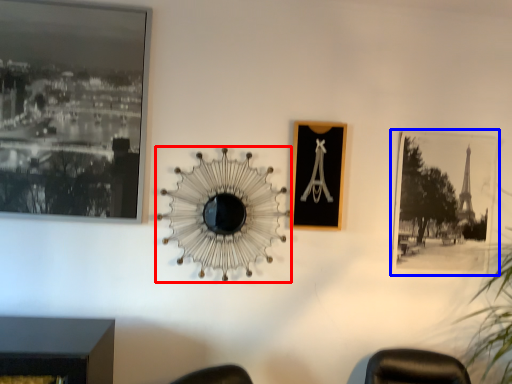
Question: Which of the following is the closest to the observer, mirror (highlighted by a red box) or picture frame (highlighted by a blue box)?

Choices:
 (A) mirror
 (B) picture frame

Answer: (A)